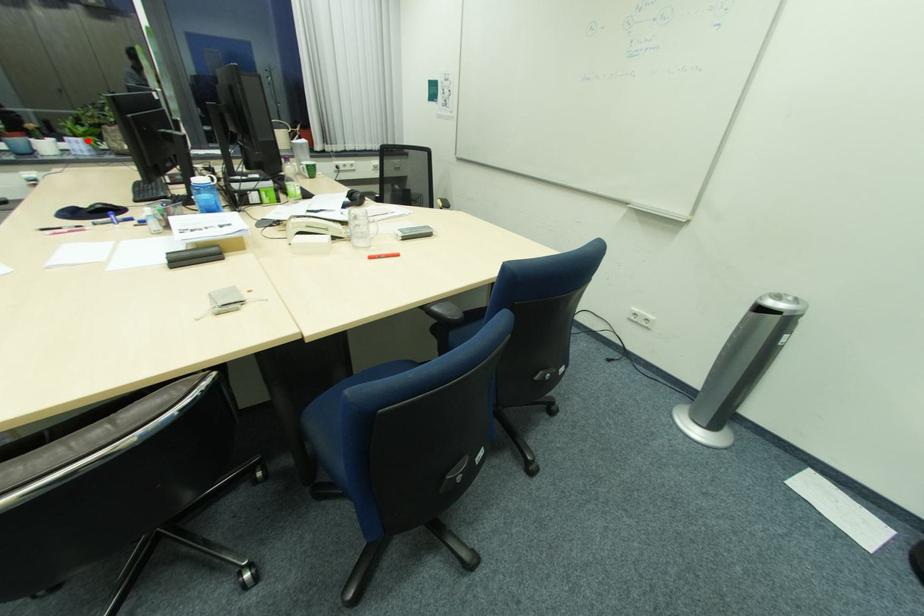
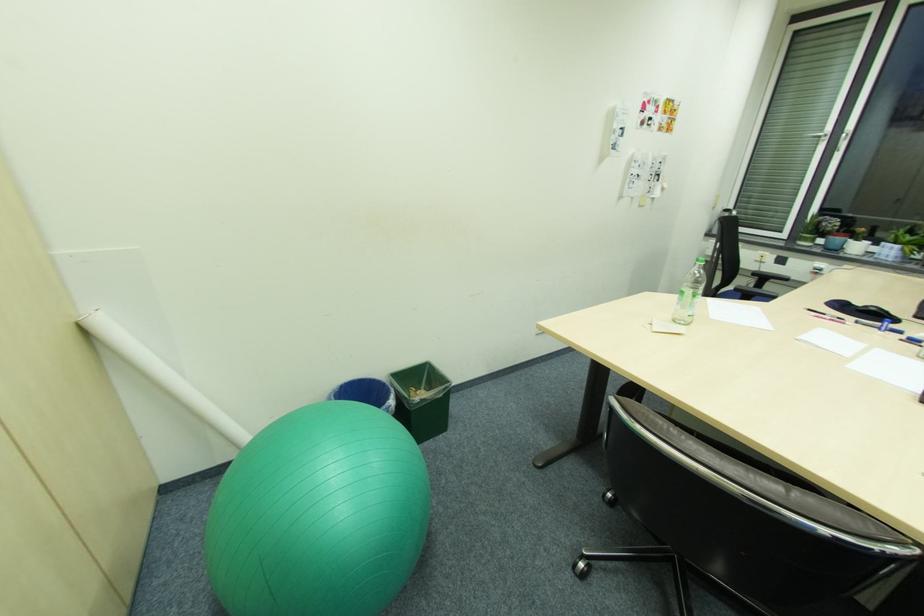
Question: I am providing you with two images of the same scene from different viewpoints. Image1 has a red point marked. In image2, the corresponding 3D location appears at what relative position? Reply with the corresponding letter.

Choices:
 (A) Closer
 (B) Farther

Answer: (B)